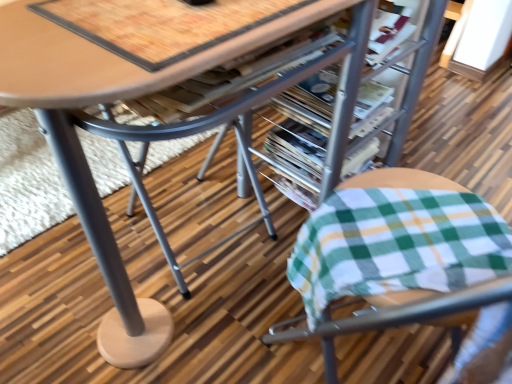
Question: Does metallic silver magazine at center, the second magazine in the back-to-front sequence, have a greater height compared to green plaid fabric cushion at lower right?

Choices:
 (A) yes
 (B) no

Answer: (B)

Question: Considering the relative sizes of metallic silver magazine at center, the second magazine in the back-to-front sequence, and green plaid fabric cushion at lower right in the image provided, is metallic silver magazine at center, the second magazine in the back-to-front sequence, shorter than green plaid fabric cushion at lower right?

Choices:
 (A) yes
 (B) no

Answer: (A)

Question: From a real-world perspective, is metallic silver magazine at center, the first magazine positioned from the front, positioned under green plaid fabric cushion at lower right based on gravity?

Choices:
 (A) no
 (B) yes

Answer: (B)

Question: Considering the relative positions of metallic silver magazine at center, the first magazine positioned from the front, and green plaid fabric cushion at lower right in the image provided, is metallic silver magazine at center, the first magazine positioned from the front, to the left of green plaid fabric cushion at lower right from the viewer's perspective?

Choices:
 (A) no
 (B) yes

Answer: (B)

Question: Is metallic silver magazine at center, the second magazine in the back-to-front sequence, not within green plaid fabric cushion at lower right?

Choices:
 (A) no
 (B) yes

Answer: (B)

Question: From a real-world perspective, is metallic silver magazine at center, the first magazine positioned from the front, on green plaid fabric cushion at lower right?

Choices:
 (A) no
 (B) yes

Answer: (A)

Question: Is green plaid fabric cushion at lower right at the left side of wooden table at center?

Choices:
 (A) no
 (B) yes

Answer: (A)

Question: Is the surface of green plaid fabric cushion at lower right in direct contact with wooden table at center?

Choices:
 (A) yes
 (B) no

Answer: (B)

Question: From the image's perspective, would you say green plaid fabric cushion at lower right is shown under wooden table at center?

Choices:
 (A) no
 (B) yes

Answer: (B)

Question: Is green plaid fabric cushion at lower right smaller than wooden table at center?

Choices:
 (A) no
 (B) yes

Answer: (B)

Question: Could you tell me if green plaid fabric cushion at lower right is facing wooden table at center?

Choices:
 (A) no
 (B) yes

Answer: (B)

Question: Can you confirm if green plaid fabric cushion at lower right is taller than wooden table at center?

Choices:
 (A) no
 (B) yes

Answer: (A)

Question: From a real-world perspective, is metallic silver magazine at center, the first magazine viewed from the back, physically above metallic silver magazine at center, the first magazine positioned from the front?

Choices:
 (A) yes
 (B) no

Answer: (B)